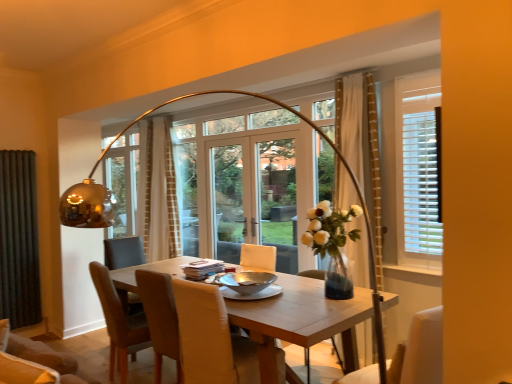
This screenshot has height=384, width=512. What do you see at coordinates (194, 330) in the screenshot?
I see `leather at center, which is the 2th chair from back to front` at bounding box center [194, 330].

What is the approximate width of white fabric curtain at right, placed as the third curtain when sorted from back to front?

The width of white fabric curtain at right, placed as the third curtain when sorted from back to front, is 9.94 inches.

What do you see at coordinates (420, 351) in the screenshot? Image resolution: width=512 pixels, height=384 pixels. I see `white fabric chair at lower right, which is the third chair in back-to-front order` at bounding box center [420, 351].

This screenshot has width=512, height=384. Describe the element at coordinates (253, 196) in the screenshot. I see `clear glass door at center` at that location.

Describe the element at coordinates (119, 324) in the screenshot. I see `brown leather chair at center, which appears as the 3th chair when viewed from the right` at that location.

Describe the element at coordinates (301, 320) in the screenshot. I see `light brown wooden table at center` at that location.

Where is `beige textured curtain at center, the first curtain when ordered from back to front`? This screenshot has height=384, width=512. beige textured curtain at center, the first curtain when ordered from back to front is located at coordinates (157, 192).

Is black fabric curtain at left, which is counted as the 2th curtain, starting from the back, at the back of white fabric chair at lower right, which is the 1th chair from right to left?

No, white fabric chair at lower right, which is the 1th chair from right to left, is not facing away from black fabric curtain at left, which is counted as the 2th curtain, starting from the back.

Does white fabric chair at lower right, which is the 1th chair from right to left, have a greater height compared to black fabric curtain at left, which is counted as the third curtain, starting from the right?

In fact, white fabric chair at lower right, which is the 1th chair from right to left, may be shorter than black fabric curtain at left, which is counted as the third curtain, starting from the right.

From the image's perspective, does white fabric chair at lower right, which appears as the 3th chair when viewed from the left, appear higher than black fabric curtain at left, which is the 1th curtain in left-to-right order?

Incorrect, from the image's perspective, white fabric chair at lower right, which appears as the 3th chair when viewed from the left, is lower than black fabric curtain at left, which is the 1th curtain in left-to-right order.

Image resolution: width=512 pixels, height=384 pixels. I want to click on chair that is the 3rd object located in front of the black fabric curtain at left, which is counted as the 2th curtain, starting from the back, so click(420, 351).

Where is `curtain that is the 2nd object located above the brown leather chair at center, acting as the first chair starting from the back (from the image's perspective)`? curtain that is the 2nd object located above the brown leather chair at center, acting as the first chair starting from the back (from the image's perspective) is located at coordinates (358, 130).

From the picture: Does brown leather chair at center, acting as the first chair starting from the left, contain white fabric curtain at right, acting as the 1th curtain starting from the front?

Actually, white fabric curtain at right, acting as the 1th curtain starting from the front, is outside brown leather chair at center, acting as the first chair starting from the left.

Can you confirm if brown leather chair at center, which appears as the 3th chair when viewed from the right, is taller than white fabric curtain at right, acting as the 1th curtain starting from the front?

In fact, brown leather chair at center, which appears as the 3th chair when viewed from the right, may be shorter than white fabric curtain at right, acting as the 1th curtain starting from the front.

Is white fabric curtain at right, placed as the third curtain when sorted from back to front, positioned with its back to brown leather chair at center, acting as the first chair starting from the left?

No, white fabric curtain at right, placed as the third curtain when sorted from back to front,'s orientation is not away from brown leather chair at center, acting as the first chair starting from the left.

Does white fabric curtain at right, the third curtain when ordered from left to right, come behind brown leather chair at center, placed as the third chair when sorted from front to back?

That is True.

Based on the photo, is white fabric curtain at right, placed as the third curtain when sorted from back to front, positioned beyond the bounds of brown leather chair at center, acting as the first chair starting from the left?

Yes, white fabric curtain at right, placed as the third curtain when sorted from back to front, is not within brown leather chair at center, acting as the first chair starting from the left.

From a real-world perspective, is light brown wooden table at center positioned under beige textured curtain at center, the 3th curtain viewed from the front, based on gravity?

Indeed, from a real-world perspective, light brown wooden table at center is positioned beneath beige textured curtain at center, the 3th curtain viewed from the front.

Is light brown wooden table at center spatially inside beige textured curtain at center, the 2th curtain from the left, or outside of it?

light brown wooden table at center is spatially situated outside beige textured curtain at center, the 2th curtain from the left.

Is light brown wooden table at center aimed at beige textured curtain at center, the first curtain when ordered from back to front?

No, light brown wooden table at center is not aimed at beige textured curtain at center, the first curtain when ordered from back to front.

From the image's perspective, is light brown wooden table at center on beige textured curtain at center, which is the 2th curtain in right-to-left order?

Actually, light brown wooden table at center appears below beige textured curtain at center, which is the 2th curtain in right-to-left order, in the image.

Based on their sizes in the image, would you say clear glass door at center is bigger or smaller than white fabric chair at lower right, which is the third chair in back-to-front order?

Clearly, clear glass door at center is larger in size than white fabric chair at lower right, which is the third chair in back-to-front order.

Can you confirm if clear glass door at center is shorter than white fabric chair at lower right, which is the 1th chair from right to left?

No.

From the image's perspective, would you say clear glass door at center is shown under white fabric chair at lower right, which is the third chair in back-to-front order?

Answer: No.

Considering the sizes of clear glass door at center and white fabric chair at lower right, the 1th chair when ordered from front to back, in the image, is clear glass door at center wider or thinner than white fabric chair at lower right, the 1th chair when ordered from front to back,?

clear glass door at center is thinner than white fabric chair at lower right, the 1th chair when ordered from front to back.

Would you say black fabric curtain at left, which is the 1th curtain in left-to-right order, contains beige textured curtain at center, the first curtain when ordered from back to front?

That's incorrect, beige textured curtain at center, the first curtain when ordered from back to front, is not inside black fabric curtain at left, which is the 1th curtain in left-to-right order.

Does black fabric curtain at left, which is the 1th curtain in left-to-right order, have a greater height compared to beige textured curtain at center, the 3th curtain viewed from the front?

Incorrect, the height of black fabric curtain at left, which is the 1th curtain in left-to-right order, is not larger of that of beige textured curtain at center, the 3th curtain viewed from the front.

Does black fabric curtain at left, marked as the 2th curtain in a front-to-back arrangement, have a greater width compared to beige textured curtain at center, which is the 2th curtain in right-to-left order?

Incorrect, the width of black fabric curtain at left, marked as the 2th curtain in a front-to-back arrangement, does not surpass that of beige textured curtain at center, which is the 2th curtain in right-to-left order.

Based on the photo, between white fabric curtain at right, placed as the third curtain when sorted from back to front, and light brown wooden table at center, which one appears on the right side from the viewer's perspective?

Positioned to the right is white fabric curtain at right, placed as the third curtain when sorted from back to front.

Is white fabric curtain at right, placed as the third curtain when sorted from back to front, oriented towards light brown wooden table at center?

No, white fabric curtain at right, placed as the third curtain when sorted from back to front, is not aimed at light brown wooden table at center.

Does white fabric curtain at right, acting as the 1th curtain starting from the front, contain light brown wooden table at center?

That's incorrect, light brown wooden table at center is not inside white fabric curtain at right, acting as the 1th curtain starting from the front.

Can you confirm if white fabric curtain at right, acting as the 1th curtain starting from the front, is bigger than light brown wooden table at center?

No.

Which curtain is the 2nd one when counting from the left side of the white fabric chair at lower right, which is the third chair in back-to-front order? Please provide its 2D coordinates.

[(19, 240)]

Which chair is the 1st one when counting from the front of the white fabric curtain at right, the third curtain when ordered from left to right? Please provide its 2D coordinates.

[(119, 324)]

Estimate the real-world distances between objects in this image. Which object is closer to beige textured curtain at center, which is the 2th curtain in right-to-left order, leather at center, acting as the second chair starting from the front, or clear glass door at center?

clear glass door at center lies closer to beige textured curtain at center, which is the 2th curtain in right-to-left order, than the other object.

Considering their positions, is beige textured curtain at center, the first curtain when ordered from back to front, positioned closer to clear glass door at center than light brown wooden table at center?

beige textured curtain at center, the first curtain when ordered from back to front, lies closer to clear glass door at center than the other object.

When comparing their distances from brown leather chair at center, placed as the third chair when sorted from front to back, does clear glass door at center or leather at center, acting as the second chair starting from the front, seem further?

The object further to brown leather chair at center, placed as the third chair when sorted from front to back, is clear glass door at center.

When comparing their distances from leather at center, acting as the second chair starting from the left, does white fabric curtain at right, the third curtain when ordered from left to right, or white fabric chair at lower right, which is the third chair in back-to-front order, seem closer?

white fabric chair at lower right, which is the third chair in back-to-front order, lies closer to leather at center, acting as the second chair starting from the left, than the other object.

Looking at the image, which one is located closer to light brown wooden table at center, beige textured curtain at center, the 2th curtain from the left, or white fabric chair at lower right, the 1th chair when ordered from front to back?

The object closer to light brown wooden table at center is white fabric chair at lower right, the 1th chair when ordered from front to back.

Looking at this image, considering their positions, is white fabric curtain at right, the third curtain when ordered from left to right, positioned closer to clear glass door at center than light brown wooden table at center?

white fabric curtain at right, the third curtain when ordered from left to right, is positioned closer to the anchor clear glass door at center.

Estimate the real-world distances between objects in this image. Which object is closer to beige textured curtain at center, the 3th curtain viewed from the front, white fabric curtain at right, the third curtain when ordered from left to right, or leather at center, acting as the second chair starting from the left?

leather at center, acting as the second chair starting from the left, is positioned closer to the anchor beige textured curtain at center, the 3th curtain viewed from the front.

Considering their positions, is light brown wooden table at center positioned closer to beige textured curtain at center, which is the 2th curtain in right-to-left order, than brown leather chair at center, placed as the third chair when sorted from front to back?

brown leather chair at center, placed as the third chair when sorted from front to back.

Where is `chair between leather at center, acting as the second chair starting from the front, and beige textured curtain at center, the first curtain when ordered from back to front, along the z-axis`? chair between leather at center, acting as the second chair starting from the front, and beige textured curtain at center, the first curtain when ordered from back to front, along the z-axis is located at coordinates (119, 324).

Identify the location of screen door between beige textured curtain at center, which is the 2th curtain in right-to-left order, and white fabric curtain at right, acting as the first curtain starting from the right, in the horizontal direction. This screenshot has height=384, width=512. (253, 196).

At what (x,y) coordinates should I click in order to perform the action: click on kitchen & dining room table positioned between white fabric chair at lower right, which is the third chair in back-to-front order, and clear glass door at center from near to far. Please return your answer as a coordinate pair (x, y). Looking at the image, I should click on (301, 320).

The width and height of the screenshot is (512, 384). In order to click on kitchen & dining room table between brown leather chair at center, placed as the third chair when sorted from front to back, and white fabric curtain at right, acting as the 1th curtain starting from the front in this screenshot , I will do `click(301, 320)`.